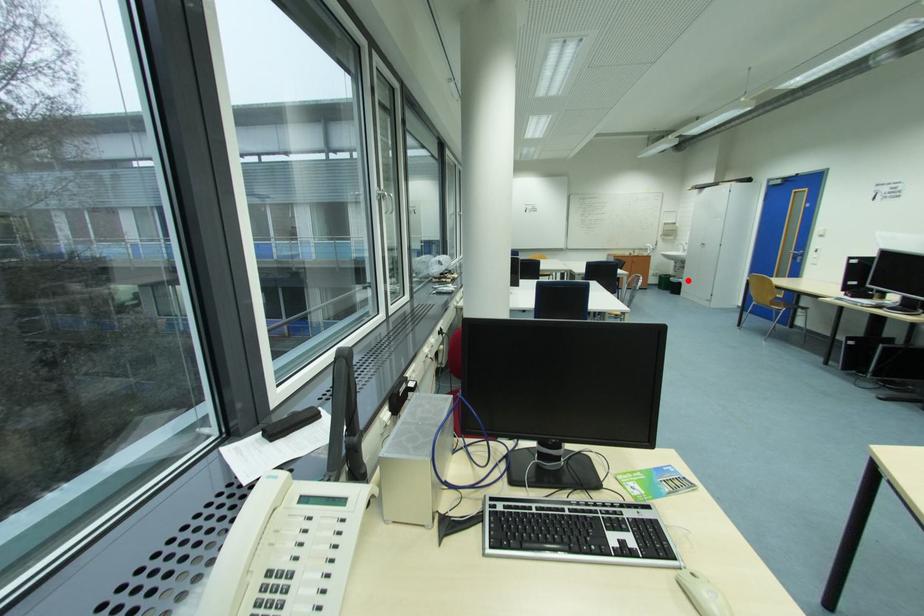
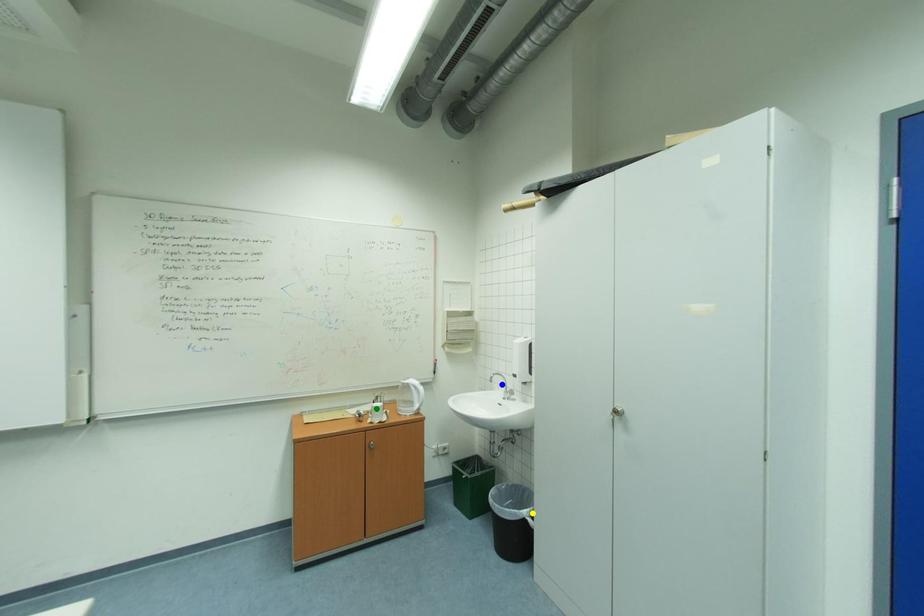
Question: I am providing you with two images of the same scene from different viewpoints. A red point is marked on the first image. You are given multiple points on the second image. Which point in image 2 is actually the same real-world point as the red point in image 1?

Choices:
 (A) blue point
 (B) green point
 (C) yellow point

Answer: (C)